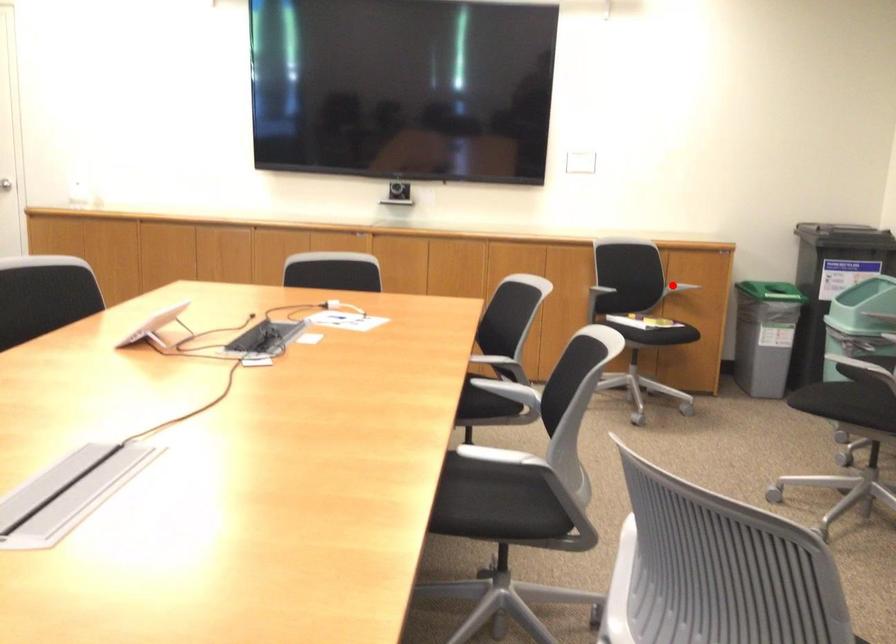
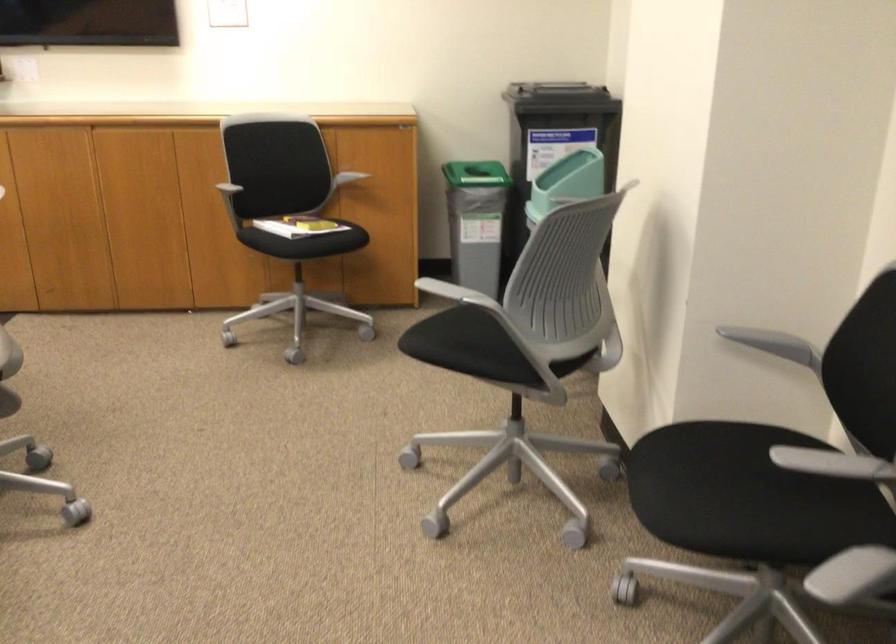
Question: I am providing you with two images of the same scene from different viewpoints. A red point is marked on the first image. Is the red point's position out of view in image 2?

Choices:
 (A) Yes
 (B) No

Answer: (A)